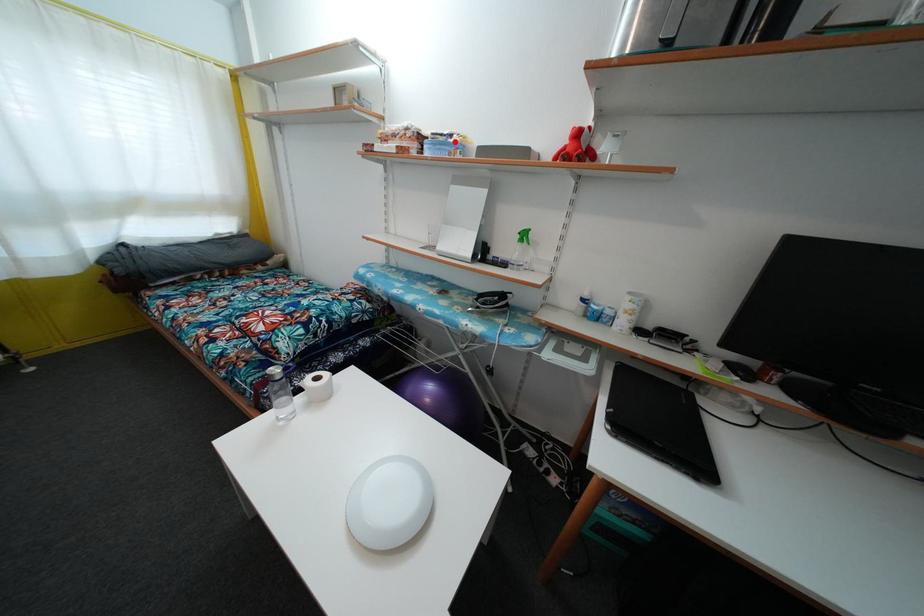
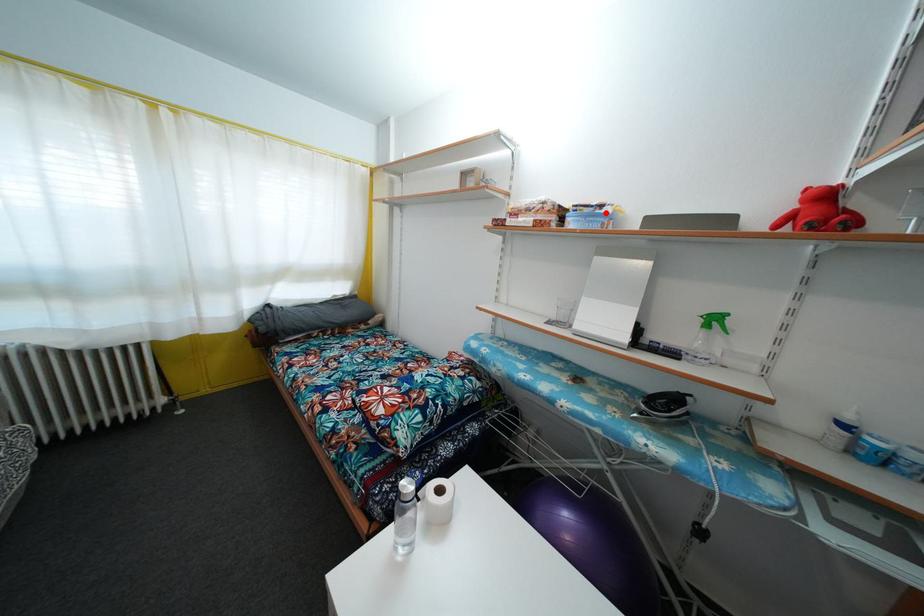
I am providing you with two images of the same scene from different viewpoints. A red point is marked on the first image and another point is marked on the second image. Is the red point in image1 aligned with the point shown in image2?

Yes